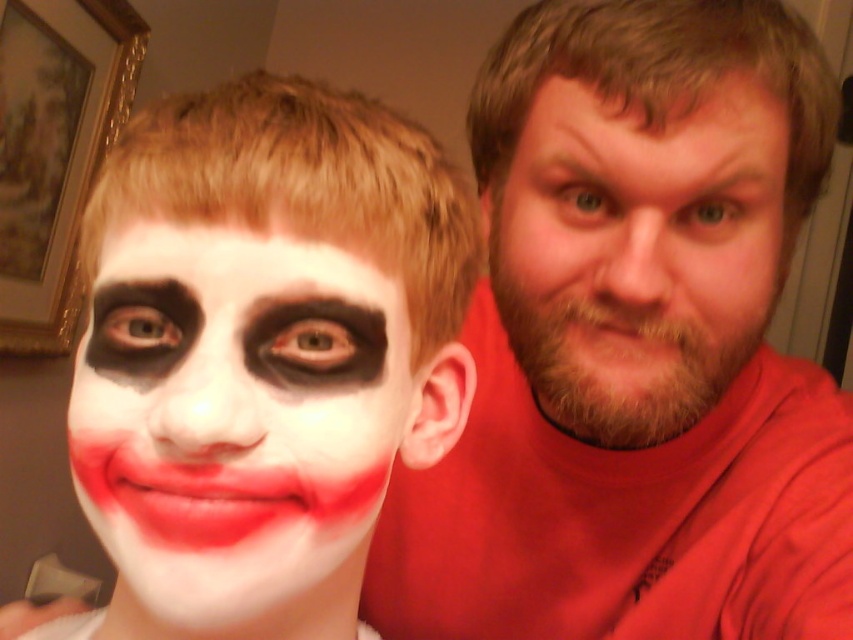
Question: Is white matte face paint at center below bearded man at right?

Choices:
 (A) yes
 (B) no

Answer: (A)

Question: Which of the following is the closest to the observer?

Choices:
 (A) pos(728,92)
 (B) pos(236,372)

Answer: (B)

Question: Among these objects, which one is nearest to the camera?

Choices:
 (A) bearded man at right
 (B) smooth red shirt at right
 (C) white matte face paint at center

Answer: (C)

Question: From the image, what is the correct spatial relationship of white matte face paint at center in relation to bearded man at right?

Choices:
 (A) left
 (B) right

Answer: (A)

Question: Can you confirm if smooth red shirt at right is wider than bearded man at right?

Choices:
 (A) no
 (B) yes

Answer: (B)

Question: Among these points, which one is farthest from the camera?

Choices:
 (A) (363, 388)
 (B) (712, 253)

Answer: (B)